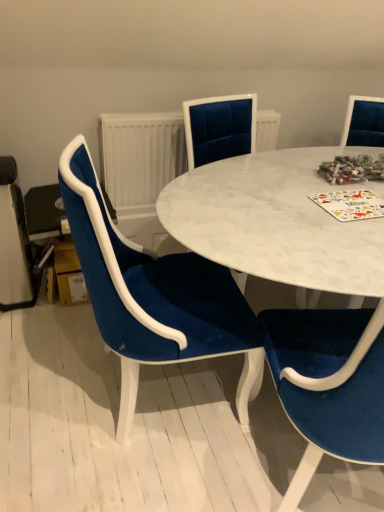
Question: Is velvet blue chair at left, which appears as the second chair when viewed from the right, directly adjacent to multicolored paper at center?

Choices:
 (A) yes
 (B) no

Answer: (B)

Question: From a real-world perspective, does velvet blue chair at left, which is the first chair in left-to-right order, stand above multicolored paper at center?

Choices:
 (A) yes
 (B) no

Answer: (B)

Question: Is velvet blue chair at left, which is the first chair in left-to-right order, facing towards multicolored paper at center?

Choices:
 (A) no
 (B) yes

Answer: (B)

Question: From a real-world perspective, is velvet blue chair at left, which appears as the second chair when viewed from the right, located beneath multicolored paper at center?

Choices:
 (A) yes
 (B) no

Answer: (A)

Question: Is velvet blue chair at left, which appears as the second chair when viewed from the right, far away from multicolored paper at center?

Choices:
 (A) yes
 (B) no

Answer: (B)

Question: Is white textured radiator at center wider or thinner than velvet blue chair at center, which is the 1th chair in right-to-left order?

Choices:
 (A) thin
 (B) wide

Answer: (A)

Question: Is white textured radiator at center in front of or behind velvet blue chair at center, which is the 1th chair in right-to-left order, in the image?

Choices:
 (A) behind
 (B) front

Answer: (A)

Question: From the image's perspective, is white textured radiator at center positioned above or below velvet blue chair at center, which is the 1th chair in right-to-left order?

Choices:
 (A) below
 (B) above

Answer: (B)

Question: Is white textured radiator at center to the left or to the right of velvet blue chair at center, which is the 1th chair in right-to-left order, in the image?

Choices:
 (A) right
 (B) left

Answer: (B)

Question: Considering the positions of multicolored paper at center and white textured radiator at center in the image, is multicolored paper at center taller or shorter than white textured radiator at center?

Choices:
 (A) tall
 (B) short

Answer: (B)

Question: From the image's perspective, is multicolored paper at center positioned above or below white textured radiator at center?

Choices:
 (A) below
 (B) above

Answer: (A)

Question: Is multicolored paper at center inside or outside of white textured radiator at center?

Choices:
 (A) inside
 (B) outside

Answer: (B)

Question: Would you say multicolored paper at center is to the left or to the right of white textured radiator at center in the picture?

Choices:
 (A) right
 (B) left

Answer: (A)

Question: Considering the positions of velvet blue chair at left, which appears as the second chair when viewed from the right, and white marble table at center in the image, is velvet blue chair at left, which appears as the second chair when viewed from the right, taller or shorter than white marble table at center?

Choices:
 (A) short
 (B) tall

Answer: (B)

Question: Considering the positions of velvet blue chair at left, which is the first chair in left-to-right order, and white marble table at center in the image, is velvet blue chair at left, which is the first chair in left-to-right order, wider or thinner than white marble table at center?

Choices:
 (A) thin
 (B) wide

Answer: (A)